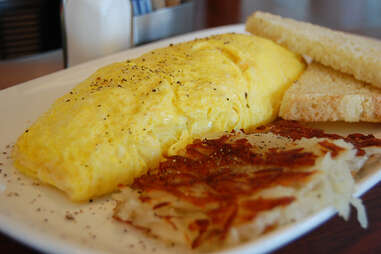
The width and height of the screenshot is (381, 254). Find the location of `table`. table is located at coordinates (320, 244).